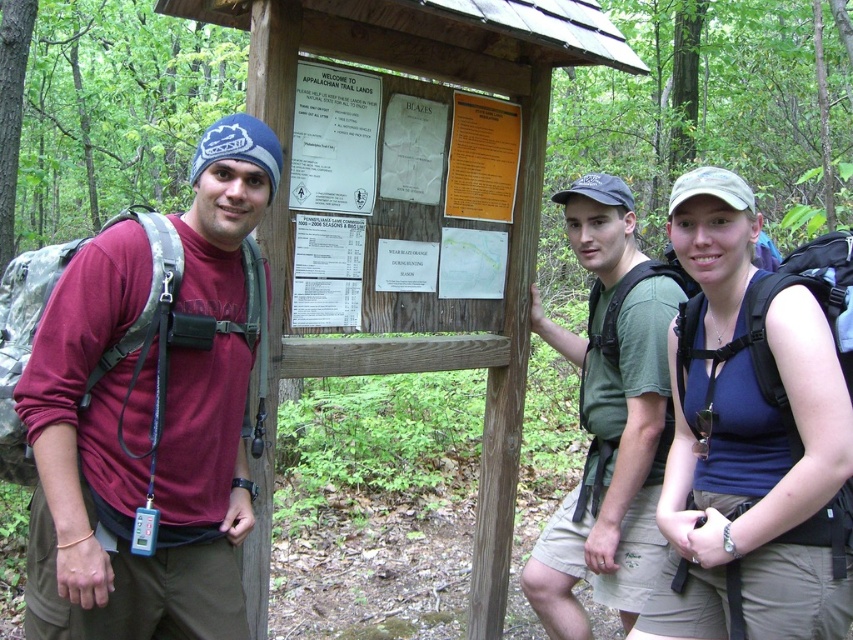
You are a photographer trying to capture a group photo of the maroon fabric shirt at left and the green fabric shirt at center. Since you want to include both subjects in the frame, which subject should you position closer to the camera to ensure both are fully visible?

Since the maroon fabric shirt at left is located above the green fabric shirt at center, you should position the green fabric shirt at center closer to the camera to ensure both are fully visible.

You are a photographer taking a group photo of the maroon fabric shirt at left and the blue fabric shirt at center. Which person should stand to your left to ensure they are aligned with their current positions?

The maroon fabric shirt at left should stand to your left because they are positioned on the left side of the blue fabric shirt at center.

You are a photographer trying to capture both the blue fabric shirt at center and the green fabric shirt at center in a single frame. Which shirt should you focus on to ensure both are fully visible without cropping?

You should focus on the blue fabric shirt at center because it is wider than the green fabric shirt at center, so centering it will allow the narrower green fabric shirt at center to fit within the frame more easily.